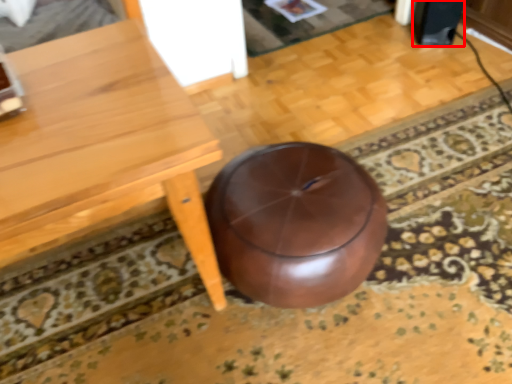
Question: Observing the image, what is the correct spatial positioning of speaker (annotated by the red box) in reference to table?

Choices:
 (A) right
 (B) left

Answer: (A)